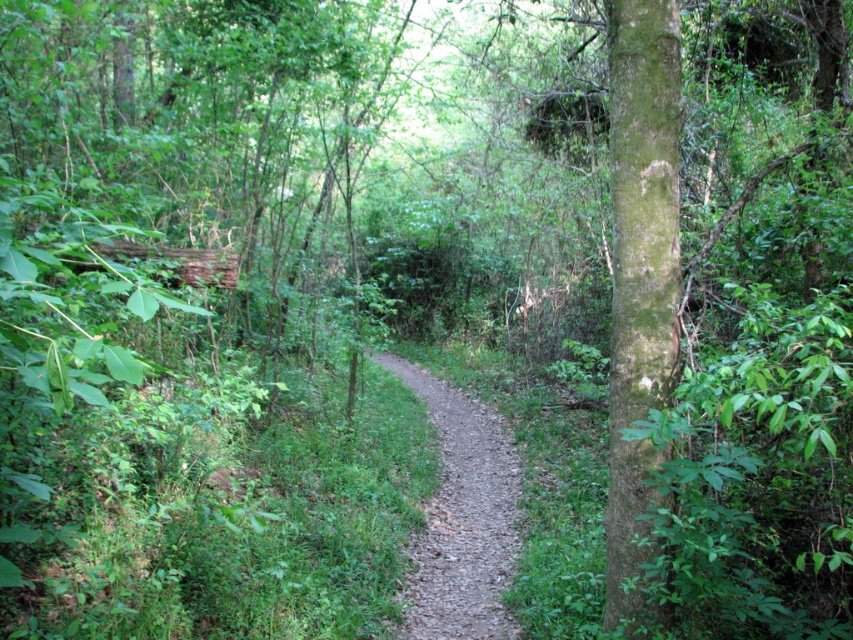
Who is more forward, (660, 205) or (438, 502)?

Point (660, 205)

Is green mossy bark tree at right above dirt path at center?

Indeed, green mossy bark tree at right is positioned over dirt path at center.

Based on the photo, who is more forward, (646, 493) or (440, 621)?

Point (646, 493) is more forward.

The image size is (853, 640). Find the location of `green mossy bark tree at right`. green mossy bark tree at right is located at coordinates (639, 280).